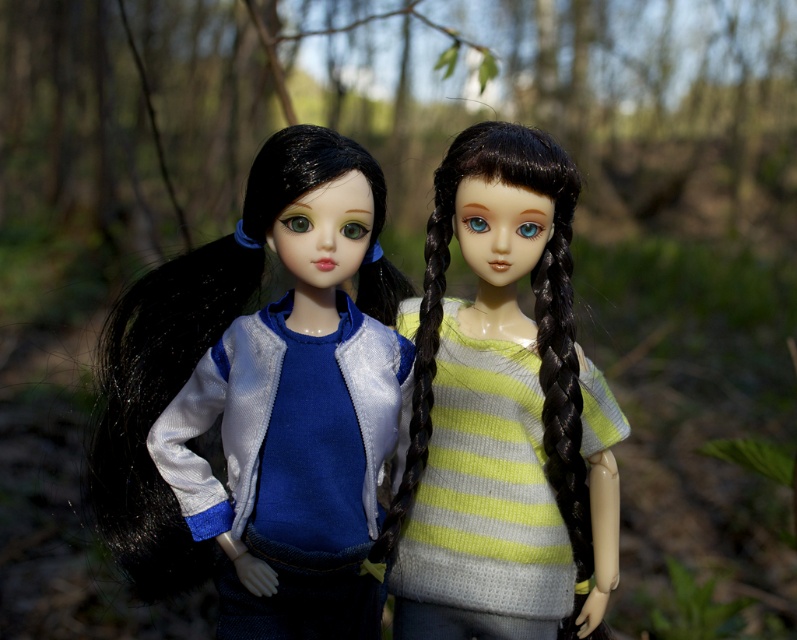
Is satin blue dress at center positioned in front of matte black hair at center?

Yes, satin blue dress at center is in front of matte black hair at center.

Is point (340, 529) positioned before point (405, 500)?

Yes, point (340, 529) is in front of point (405, 500).

Find the location of a particular element. The width and height of the screenshot is (797, 640). satin blue dress at center is located at coordinates (261, 413).

I want to click on knitted yellow-green striped sweater at center, so click(501, 413).

Who is taller, knitted yellow-green striped sweater at center or blue corduroy sweater at center?

Standing taller between the two is knitted yellow-green striped sweater at center.

Who is more forward, (411, 412) or (360, 330)?

Point (360, 330) is more forward.

What are the coordinates of `knitted yellow-green striped sweater at center` in the screenshot? It's located at (501, 413).

Can you confirm if knitted yellow-green striped sweater at center is positioned to the left of matte black hair at center?

Incorrect, knitted yellow-green striped sweater at center is not on the left side of matte black hair at center.

Does knitted yellow-green striped sweater at center come in front of matte black hair at center?

Yes.

The image size is (797, 640). Identify the location of knitted yellow-green striped sweater at center. (501, 413).

The image size is (797, 640). What are the coordinates of `knitted yellow-green striped sweater at center` in the screenshot? It's located at (501, 413).